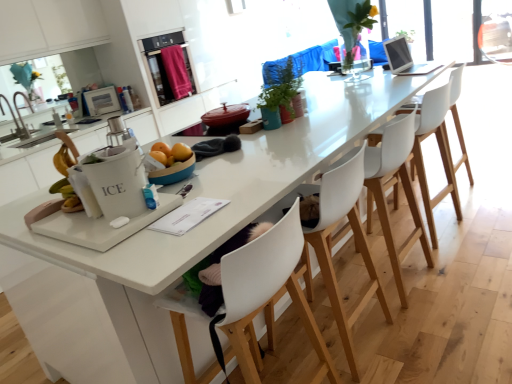
Identify the location of free point below silver metallic laptop at upper right, the second appliance positioned from the front (from a real-world perspective). The height and width of the screenshot is (384, 512). (413, 68).